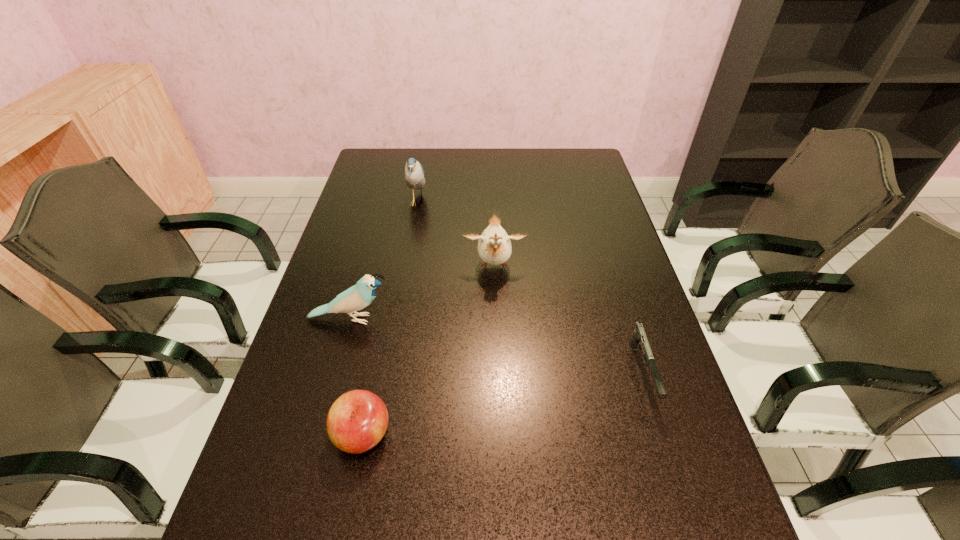
Identify the location of empty space that is in between the apple and the second farthest bird. (428, 350).

Find the location of a particular element. free spot between the second shortest object and the shortest object is located at coordinates (x=502, y=403).

Locate an element on the screen. free space between the farthest object and the nearest bird is located at coordinates (384, 260).

Locate an element on the screen. free space between the rightmost object and the farthest bird is located at coordinates (530, 287).

Where is `empty space that is in between the farthest bird and the nearest bird`? The height and width of the screenshot is (540, 960). empty space that is in between the farthest bird and the nearest bird is located at coordinates (384, 260).

This screenshot has width=960, height=540. I want to click on free spot between the farthest bird and the second nearest bird, so click(456, 234).

The width and height of the screenshot is (960, 540). I want to click on free space that is in between the nearest bird and the apple, so click(357, 377).

Locate an element on the screen. This screenshot has height=540, width=960. vacant space that's between the farthest object and the shortest object is located at coordinates (530, 287).

Locate an element on the screen. free spot between the shortest object and the farthest bird is located at coordinates (530, 287).

The image size is (960, 540). In order to click on vacant area that lies between the farthest bird and the shortest object in this screenshot , I will do `click(530, 287)`.